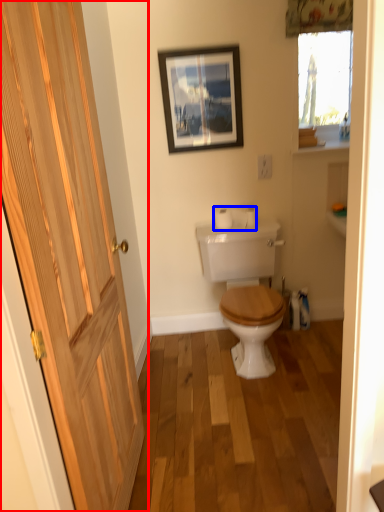
Question: Which object is closer to the camera taking this photo, door (highlighted by a red box) or toilet paper (highlighted by a blue box)?

Choices:
 (A) door
 (B) toilet paper

Answer: (A)